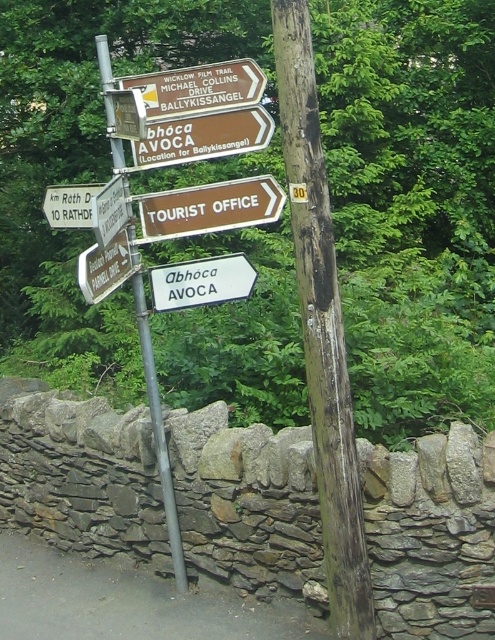
You are standing 5 meters away from a brown matte sign at center. If you walk towards it, will you be able to reach it before the distance becomes less than 6 meters?

The brown matte sign at center is currently 6.15 meters away. If you walk towards it from your current position of 5 meters away, you will have already passed the point where the distance is less than 6 meters. Therefore, you cannot reach it before the distance becomes less than 6 meters.